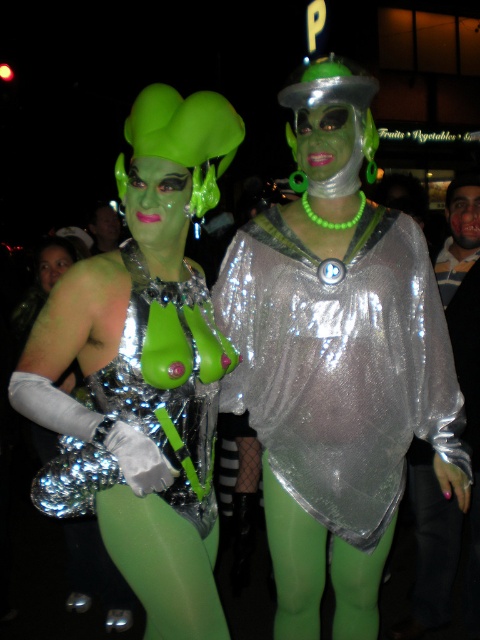
Question: Considering the relative positions of shiny metallic top at center and shiny metallic dress at center in the image provided, where is shiny metallic top at center located with respect to shiny metallic dress at center?

Choices:
 (A) above
 (B) below

Answer: (A)

Question: Observing the image, what is the correct spatial positioning of shiny metallic top at center in reference to shiny metallic dress at center?

Choices:
 (A) above
 (B) below

Answer: (A)

Question: Among these objects, which one is nearest to the camera?

Choices:
 (A) shiny metallic dress at center
 (B) shiny metallic top at center

Answer: (A)

Question: Among these objects, which one is nearest to the camera?

Choices:
 (A) shiny metallic top at center
 (B) green matte face paint at right

Answer: (A)

Question: Based on their relative distances, which object is nearer to the shiny metallic top at center?

Choices:
 (A) green metallic dress at center
 (B) shiny metallic dress at center
 (C) green matte face paint at right

Answer: (B)

Question: Is green metallic dress at center above shiny metallic dress at center?

Choices:
 (A) no
 (B) yes

Answer: (B)